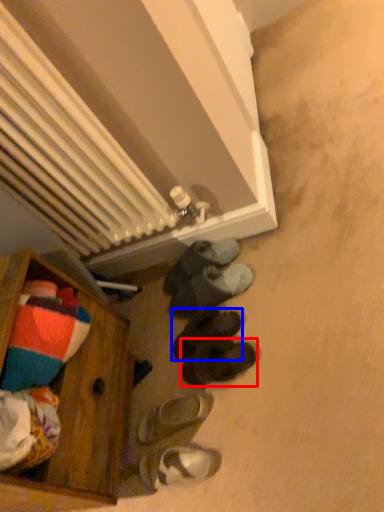
Question: Which of the following is the farthest to the observer, footwear (highlighted by a red box) or footwear (highlighted by a blue box)?

Choices:
 (A) footwear
 (B) footwear

Answer: (B)